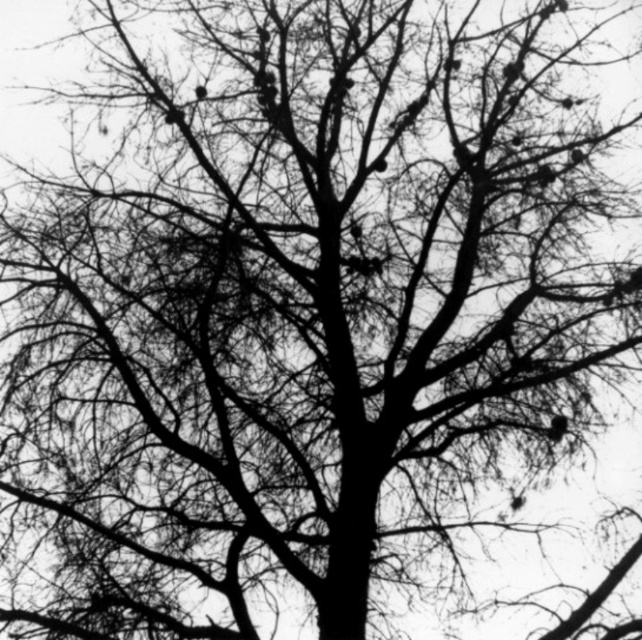
Is silky black bird at upper right smaller than dark brown feathered bird at upper center?

No.

You are a GUI agent. You are given a task and a screenshot of the screen. Output one action in this format:
    pyautogui.click(x=<x>, y=<y>)
    Task: Click on the silky black bird at upper right
    
    Given the screenshot: What is the action you would take?
    pyautogui.click(x=557, y=428)

At what (x,y) coordinates should I click in order to perform the action: click on silky black bird at upper right. Please return your answer as a coordinate pair (x, y). The image size is (642, 640). Looking at the image, I should click on (557, 428).